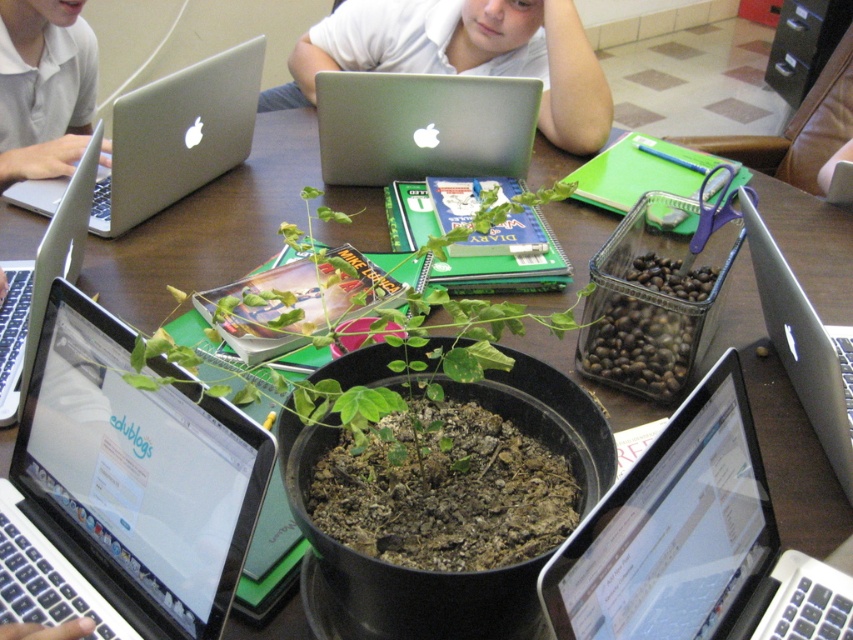
Does white matte shirt at upper center have a lesser width compared to silver metallic laptop at left?

In fact, white matte shirt at upper center might be wider than silver metallic laptop at left.

Between point (495, 49) and point (0, 381), which one is positioned in front?

Point (0, 381) is in front.

I want to click on white matte shirt at upper center, so click(463, 54).

Does silver metallic laptop at upper center have a greater width compared to silver metallic laptop at left?

Yes, silver metallic laptop at upper center is wider than silver metallic laptop at left.

Which of these two, silver metallic laptop at upper center or silver metallic laptop at left, stands taller?

silver metallic laptop at left

Which is behind, point (521, 108) or point (0, 397)?

Positioned behind is point (521, 108).

Identify the location of silver metallic laptop at upper center. (422, 125).

Does silver metallic laptop at center appear over silver metallic laptop at upper left?

Incorrect, silver metallic laptop at center is not positioned above silver metallic laptop at upper left.

Is silver metallic laptop at center taller than silver metallic laptop at upper left?

In fact, silver metallic laptop at center may be shorter than silver metallic laptop at upper left.

Which is behind, point (82, 560) or point (178, 188)?

Point (178, 188)

I want to click on silver metallic laptop at center, so click(135, 476).